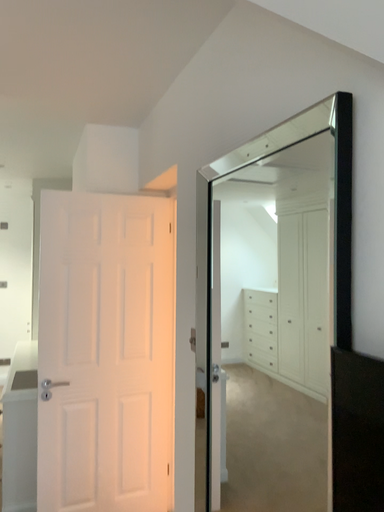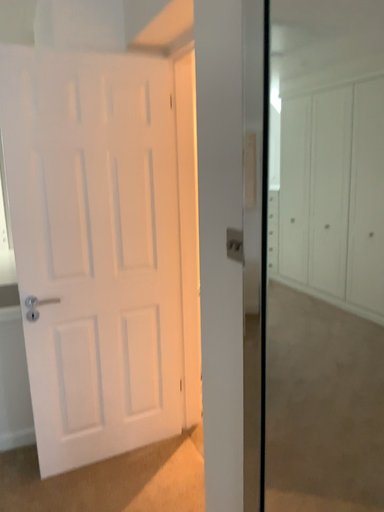
Question: How did the camera likely rotate when shooting the video?

Choices:
 (A) rotated upward
 (B) rotated downward

Answer: (B)